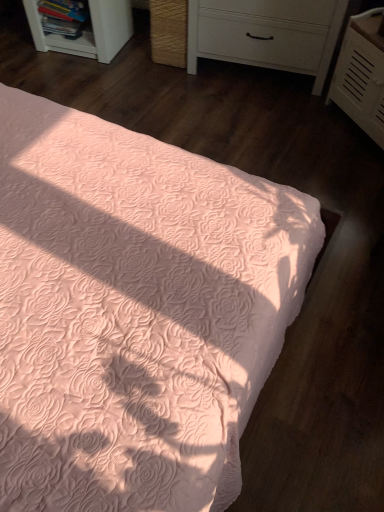
Question: Is white plastic shelf at upper left turned away from peach quilted bed at center?

Choices:
 (A) no
 (B) yes

Answer: (A)

Question: Can you confirm if white plastic shelf at upper left is positioned to the right of peach quilted bed at center?

Choices:
 (A) yes
 (B) no

Answer: (B)

Question: Considering the relative sizes of white plastic shelf at upper left and peach quilted bed at center in the image provided, is white plastic shelf at upper left shorter than peach quilted bed at center?

Choices:
 (A) no
 (B) yes

Answer: (A)

Question: Is the position of white plastic shelf at upper left less distant than that of peach quilted bed at center?

Choices:
 (A) yes
 (B) no

Answer: (B)

Question: Is white plastic shelf at upper left wider than peach quilted bed at center?

Choices:
 (A) yes
 (B) no

Answer: (B)

Question: Is peach quilted bed at center situated inside white plastic shelf at upper left or outside?

Choices:
 (A) inside
 (B) outside

Answer: (B)

Question: In terms of size, does peach quilted bed at center appear bigger or smaller than white plastic shelf at upper left?

Choices:
 (A) small
 (B) big

Answer: (B)

Question: From the image's perspective, relative to white plastic shelf at upper left, is peach quilted bed at center above or below?

Choices:
 (A) below
 (B) above

Answer: (A)

Question: From a real-world perspective, is peach quilted bed at center above or below white plastic shelf at upper left?

Choices:
 (A) below
 (B) above

Answer: (A)

Question: From a real-world perspective, is white textured chest of drawers at upper right, the 2th chest of drawers in the left-to-right sequence, physically located above or below peach quilted bed at center?

Choices:
 (A) above
 (B) below

Answer: (A)

Question: In the image, is white textured chest of drawers at upper right, which ranks as the 1th chest of drawers in right-to-left order, positioned in front of or behind peach quilted bed at center?

Choices:
 (A) behind
 (B) front

Answer: (A)

Question: Considering the relative positions of white textured chest of drawers at upper right, which ranks as the 1th chest of drawers in right-to-left order, and peach quilted bed at center in the image provided, is white textured chest of drawers at upper right, which ranks as the 1th chest of drawers in right-to-left order, to the left or to the right of peach quilted bed at center?

Choices:
 (A) right
 (B) left

Answer: (A)

Question: From the image's perspective, is white textured chest of drawers at upper right, which ranks as the 1th chest of drawers in right-to-left order, located above or below peach quilted bed at center?

Choices:
 (A) above
 (B) below

Answer: (A)

Question: Does point (334, 93) appear closer or farther from the camera than point (112, 7)?

Choices:
 (A) farther
 (B) closer

Answer: (B)

Question: Considering the positions of white textured chest of drawers at upper right, which ranks as the 1th chest of drawers in right-to-left order, and white plastic shelf at upper left in the image, is white textured chest of drawers at upper right, which ranks as the 1th chest of drawers in right-to-left order, wider or thinner than white plastic shelf at upper left?

Choices:
 (A) thin
 (B) wide

Answer: (A)